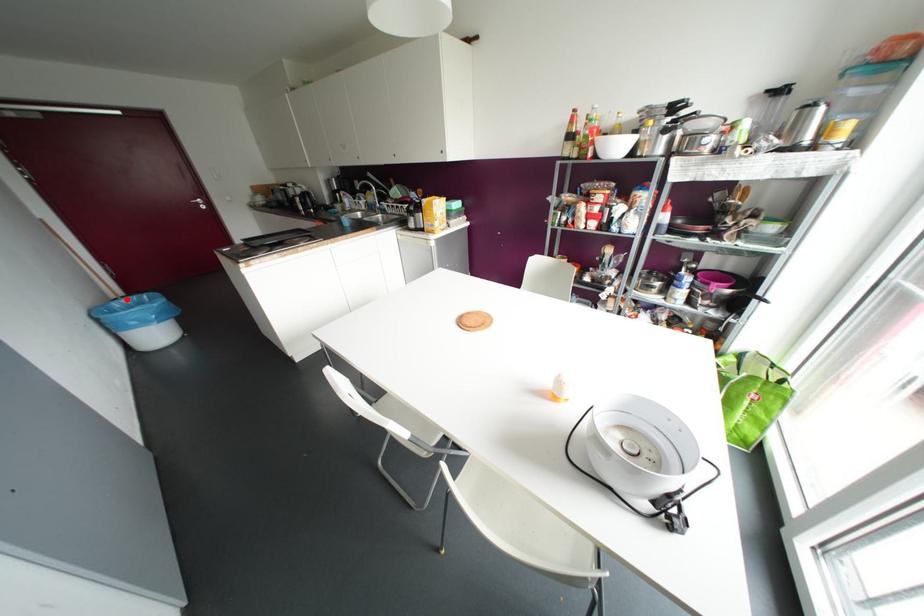
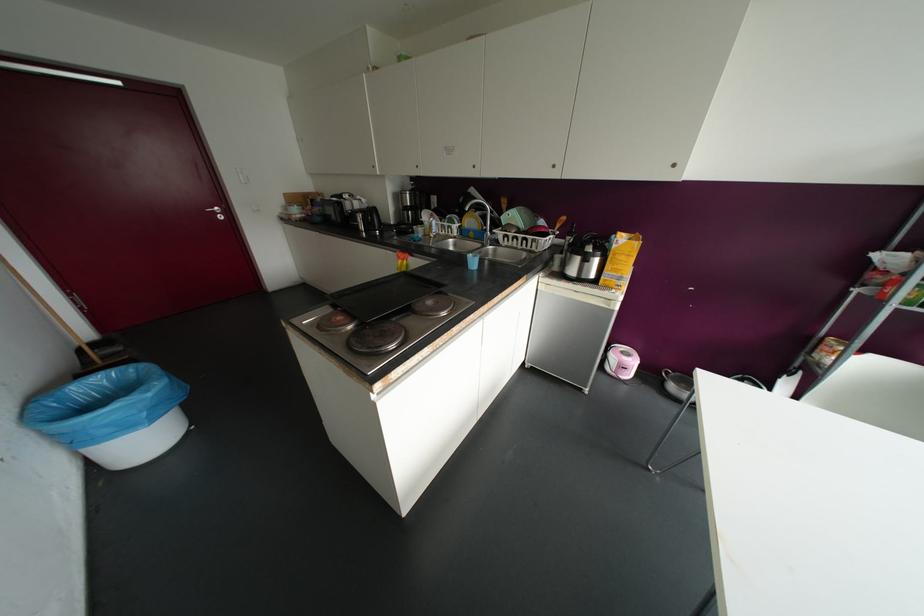
Question: I am providing you with two images of the same scene from different viewpoints. Given a red point in image1, look at the same physical point in image2. Is it:

Choices:
 (A) Closer to the viewpoint
 (B) Farther from the viewpoint

Answer: (B)